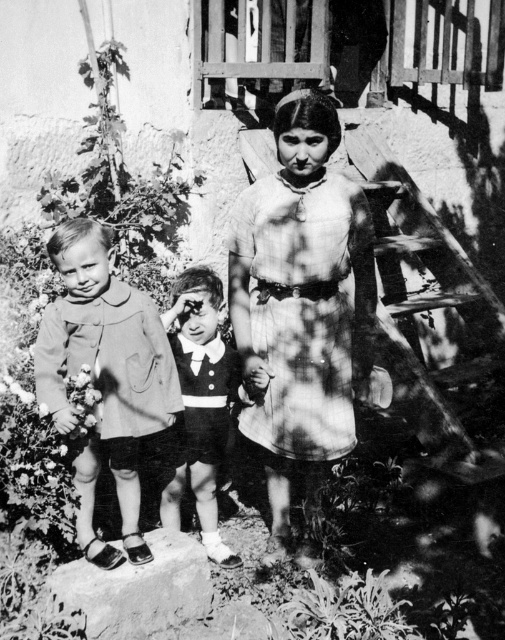
You are a photographer trying to capture the plaid fabric dress at center and the white fluffy flower at lower left in the same frame. Based on their sizes, which object would you need to focus on more closely to ensure both are visible in the photo?

The plaid fabric dress at center is bigger than the white fluffy flower at lower left, so you should focus on the plaid fabric dress at center to ensure both are visible in the photo.

You are a photographer trying to capture a closeup of the smooth black suit at center and the white fluffy flower at lower left in the scene. What is the minimum distance you need to maintain between the camera and the objects to ensure both are in focus?

The smooth black suit at center is 69.92 centimeters away from the white fluffy flower at lower left. To ensure both are in focus, the photographer should maintain a distance that allows for a depth of field covering this separation. A general rule is to position the camera at a distance roughly one third of the distance between the objects, so approximately 23.3 centimeters from the nearest object, ensuring both are within the focus range.